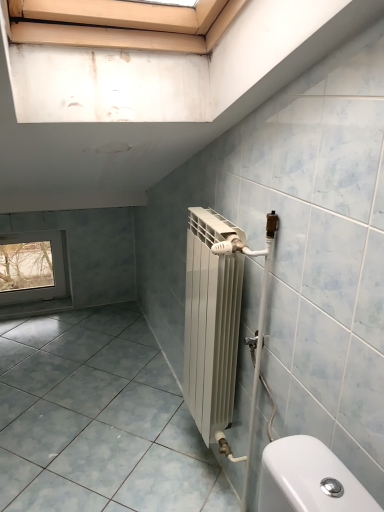
You are a GUI agent. You are given a task and a screenshot of the screen. Output one action in this format:
    pyautogui.click(x=<x>, y=<y>)
    Task: Click on the empty space that is ontop of matte gray tile at lower left (from a real-world perspective)
    The height and width of the screenshot is (512, 384).
    Given the screenshot: What is the action you would take?
    pyautogui.click(x=94, y=391)